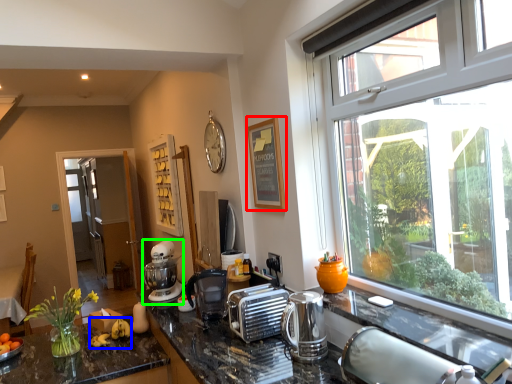
Question: Considering the real-world distances, which object is farthest from picture frame (highlighted by a red box)? banana (highlighted by a blue box) or mixer (highlighted by a green box)?

Choices:
 (A) banana
 (B) mixer

Answer: (A)